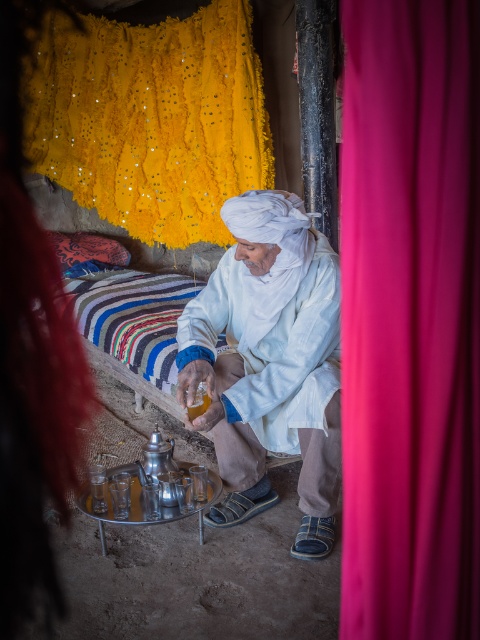
You are standing in the room and want to locate the shiny yellow fabric at upper left. According to the coordinates provided, where exactly would you look?

The shiny yellow fabric at upper left is located at point (x=151, y=118).

You are standing in the room and want to walk from the point at coordinates point (416, 300) to the point at coordinates point (177, 333). Which direction should you move in?

You should move backward because point (416, 300) is in front of point (177, 333), so moving backward will take you towards the latter point.